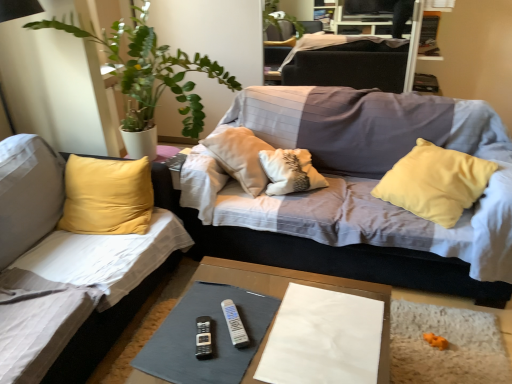
I want to click on free space in front of black plastic remote at center, the 1th remote in the left-to-right sequence, so click(202, 366).